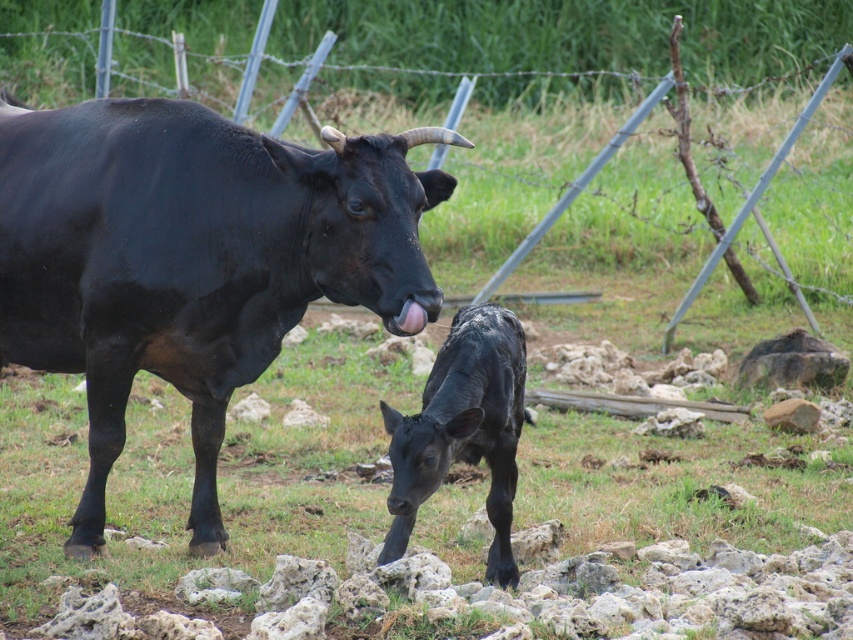
The height and width of the screenshot is (640, 853). Describe the element at coordinates (192, 259) in the screenshot. I see `shiny black buffalo at upper left` at that location.

Can you confirm if shiny black buffalo at upper left is smaller than black glossy calf at center?

Incorrect, shiny black buffalo at upper left is not smaller in size than black glossy calf at center.

Is point (67, 200) more distant than point (444, 378)?

Yes, point (67, 200) is behind point (444, 378).

Locate an element on the screen. This screenshot has height=640, width=853. shiny black buffalo at upper left is located at coordinates (192, 259).